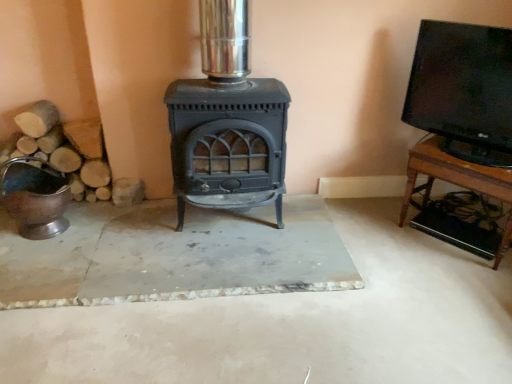
Question: Is wooden tv stand at right taller or shorter than matte black wood burning stove at center?

Choices:
 (A) short
 (B) tall

Answer: (A)

Question: Is point (466, 162) positioned closer to the camera than point (222, 137)?

Choices:
 (A) closer
 (B) farther

Answer: (B)

Question: Which object is the closest to the wooden tv stand at right?

Choices:
 (A) matte black wood burning stove at center
 (B) black glossy tv at upper right
 (C) shiny metallic bucket at left

Answer: (B)

Question: Estimate the real-world distances between objects in this image. Which object is farther from the black glossy tv at upper right?

Choices:
 (A) matte black wood burning stove at center
 (B) wooden tv stand at right
 (C) shiny metallic bucket at left

Answer: (C)